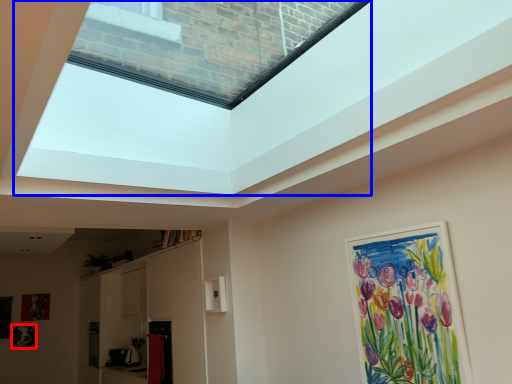
Question: Among these objects, which one is nearest to the camera, picture frame (highlighted by a red box) or window screen (highlighted by a blue box)?

Choices:
 (A) picture frame
 (B) window screen

Answer: (B)